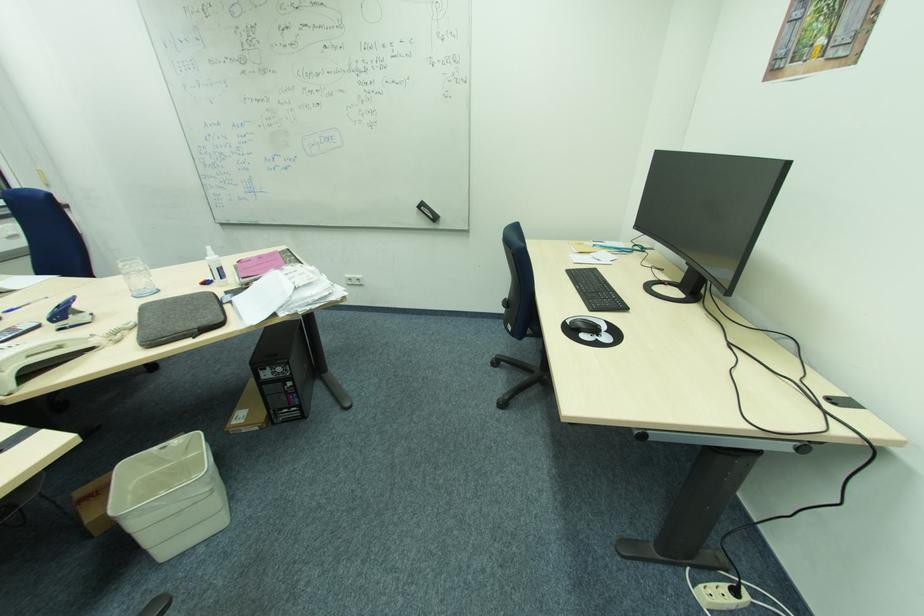
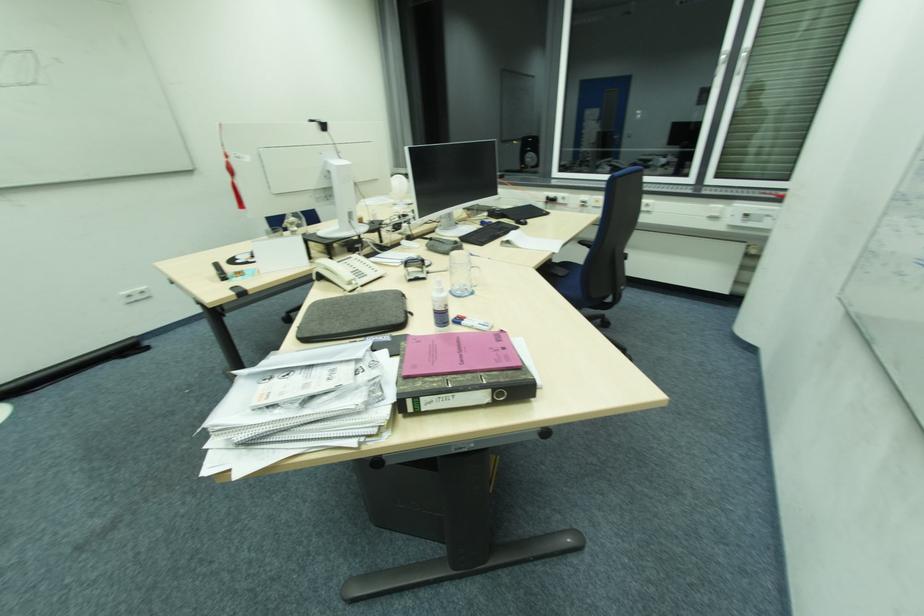
Find the pixel in the second image that matches the point at 222,306 in the first image.

(348, 331)